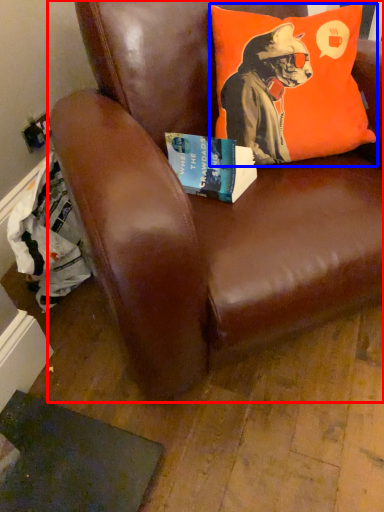
Question: Which of the following is the closest to the observer, chair (highlighted by a red box) or pillow (highlighted by a blue box)?

Choices:
 (A) chair
 (B) pillow

Answer: (A)